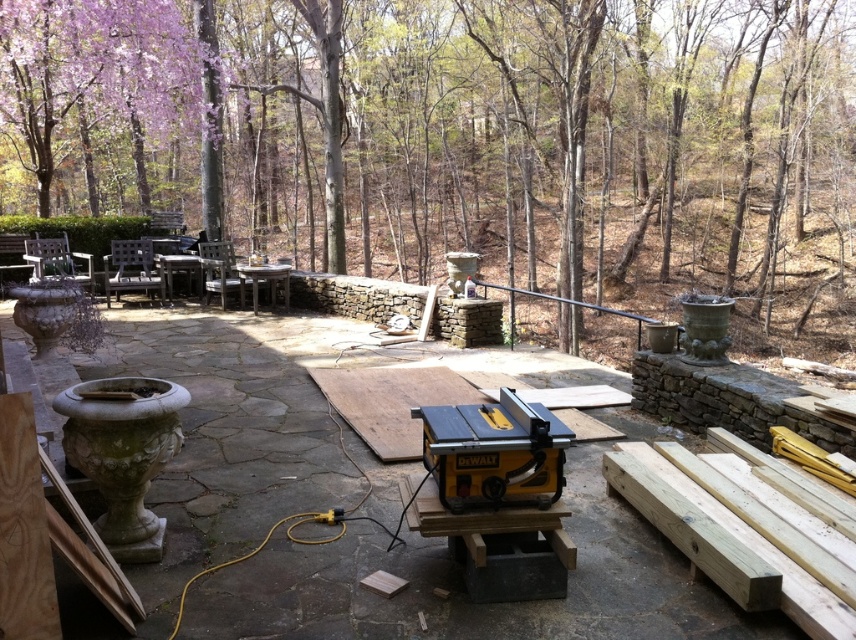
Question: Is brown wood tree at upper center to the right of yellow plastic table saw at center from the viewer's perspective?

Choices:
 (A) yes
 (B) no

Answer: (A)

Question: Observing the image, what is the correct spatial positioning of brown wood tree at upper center in reference to yellow plastic table saw at center?

Choices:
 (A) right
 (B) left

Answer: (A)

Question: Which of the following is the closest to the observer?

Choices:
 (A) (593, 508)
 (B) (770, 262)

Answer: (A)

Question: Which point appears closest to the camera in this image?

Choices:
 (A) (678, 595)
 (B) (645, 124)

Answer: (A)

Question: Among these points, which one is nearest to the camera?

Choices:
 (A) (393, 611)
 (B) (345, 48)

Answer: (A)

Question: Can you confirm if brown wood tree at upper center is positioned below yellow plastic table saw at center?

Choices:
 (A) yes
 (B) no

Answer: (B)